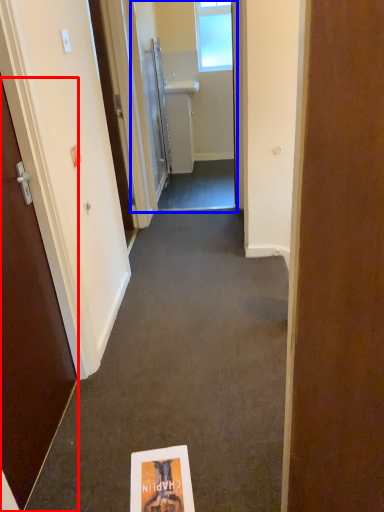
Question: Which of the following is the closest to the observer, door (highlighted by a red box) or passage (highlighted by a blue box)?

Choices:
 (A) door
 (B) passage

Answer: (A)